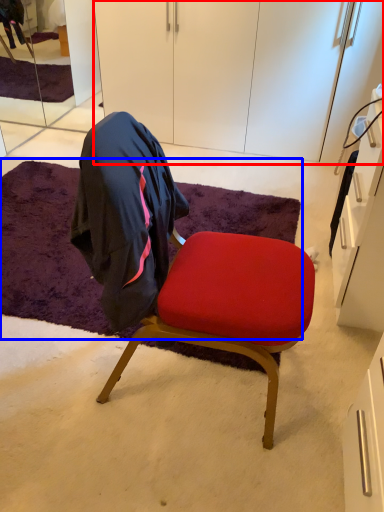
Question: Which object appears farthest to the camera in this image, cabinetry (highlighted by a red box) or mat (highlighted by a blue box)?

Choices:
 (A) cabinetry
 (B) mat

Answer: (A)